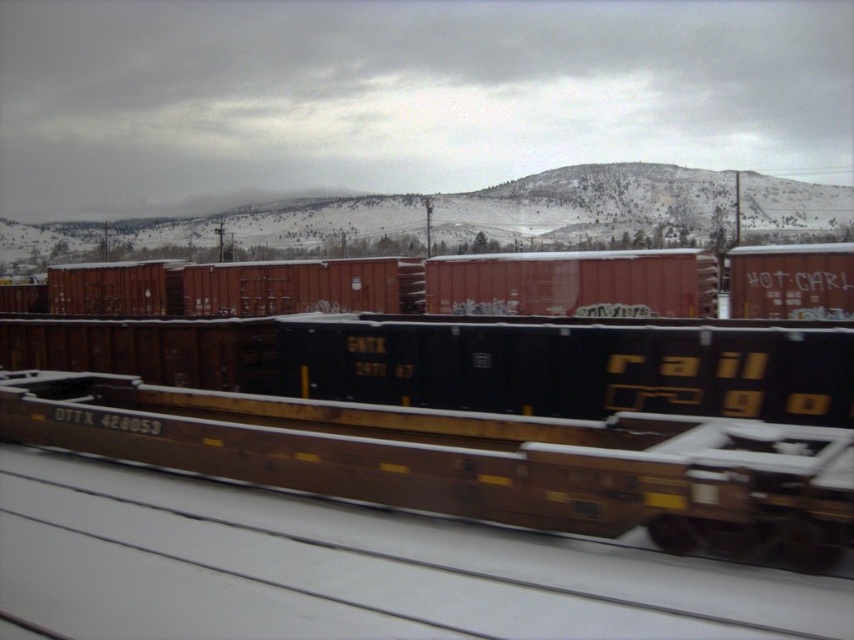
You are a photographer standing at the origin point of the image. You want to take a photo of the brown matte train car at center. What are the coordinates of the train car?

The coordinates of the brown matte train car at center are at point (x=477, y=461).

You are a train conductor who needs to load cargo onto the brown matte train car at center and the rusty metal train car at center. Since both cars are at the center, which one can you load more cargo onto based on their sizes?

The rusty metal train car at center is taller than the brown matte train car at center, so you can load more cargo onto the rusty metal train car at center.

You are a delivery person who needs to place a package on the highest object in the scene. Which object should you choose between the brown matte train car at center and the matte red container at center?

The matte red container at center is higher than the brown matte train car at center, so you should place the package on the matte red container at center.